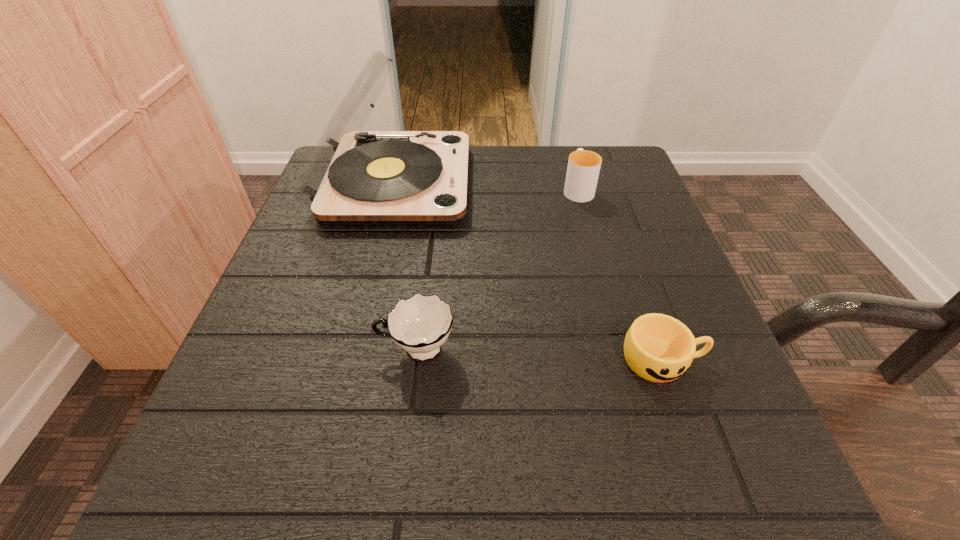
Identify the location of free space that satisfies the following two spatial constraints: 1. with the tonearm facing the front of the tallest object; 2. on the side of the leftmost cup with the handle. This screenshot has height=540, width=960. (352, 350).

Where is `free space that satisfies the following two spatial constraints: 1. with the tonearm facing the front of the record player; 2. on the side of the leftmost cup with the handle`? This screenshot has width=960, height=540. free space that satisfies the following two spatial constraints: 1. with the tonearm facing the front of the record player; 2. on the side of the leftmost cup with the handle is located at coordinates (352, 350).

Where is `free space that satisfies the following two spatial constraints: 1. with the tonearm facing the front of the tallest object; 2. on the right side of the shortest object`? The height and width of the screenshot is (540, 960). free space that satisfies the following two spatial constraints: 1. with the tonearm facing the front of the tallest object; 2. on the right side of the shortest object is located at coordinates (349, 360).

You are a GUI agent. You are given a task and a screenshot of the screen. Output one action in this format:
    pyautogui.click(x=<x>, y=<y>)
    Task: Click on the vacant space that satisfies the following two spatial constraints: 1. with the tonearm facing the front of the record player; 2. on the side of the leftmost cup with the handle
    
    Given the screenshot: What is the action you would take?
    pyautogui.click(x=352, y=350)

Find the location of `vacant space that satisfies the following two spatial constraints: 1. with the tonearm facing the front of the tallest object; 2. on the side of the leftmost cup with the handle`. vacant space that satisfies the following two spatial constraints: 1. with the tonearm facing the front of the tallest object; 2. on the side of the leftmost cup with the handle is located at coordinates (352, 350).